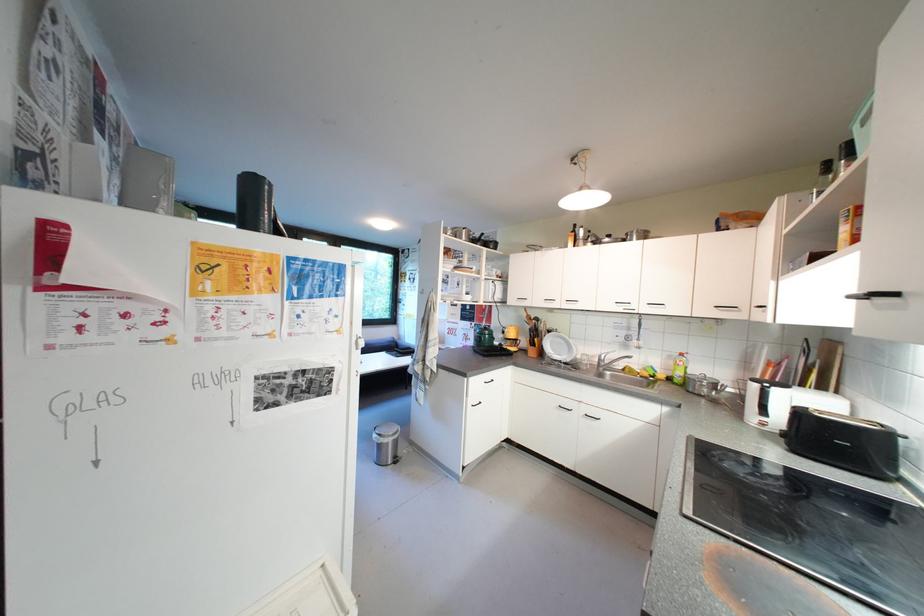
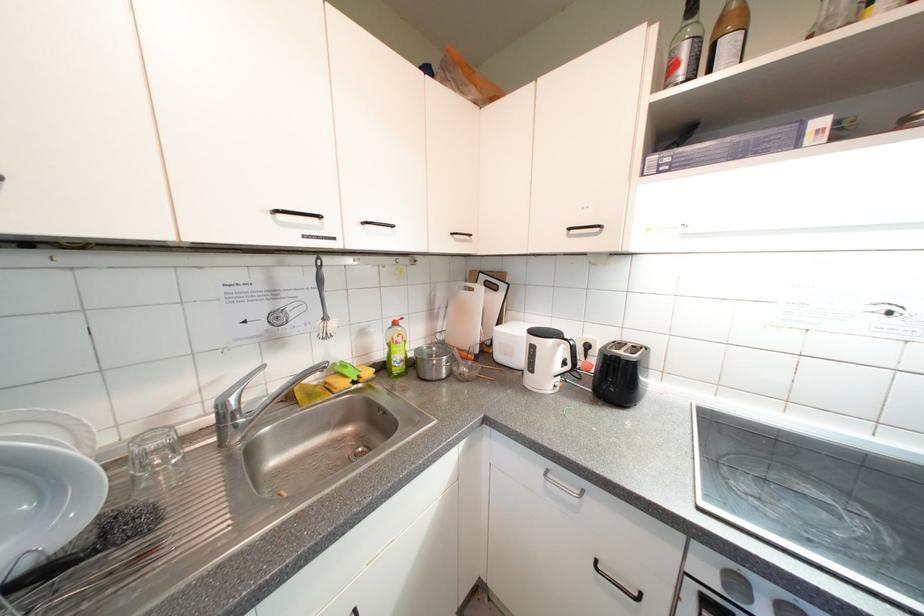
The point at (x=592, y=360) is marked in the first image. Where is the corresponding point in the second image?

(162, 447)